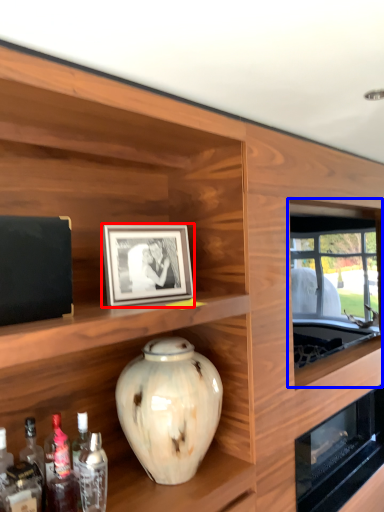
Question: Which point is further to the camera, picture frame (highlighted by a red box) or window (highlighted by a blue box)?

Choices:
 (A) picture frame
 (B) window

Answer: (B)